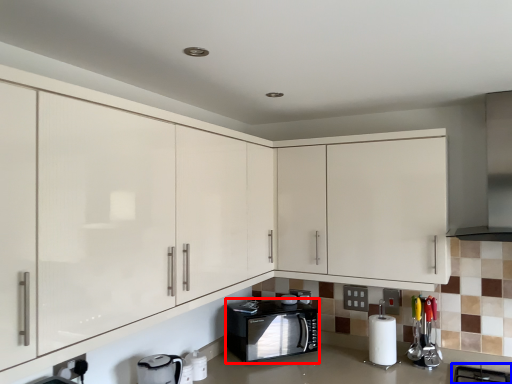
Question: Which object appears closest to the camera in this image, home appliance (highlighted by a red box) or gas stove (highlighted by a blue box)?

Choices:
 (A) home appliance
 (B) gas stove

Answer: (B)